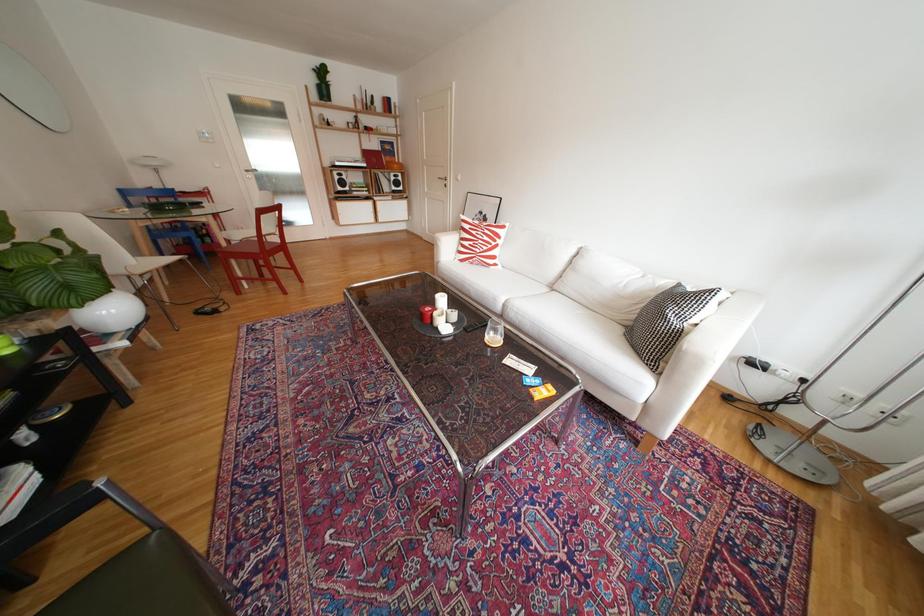
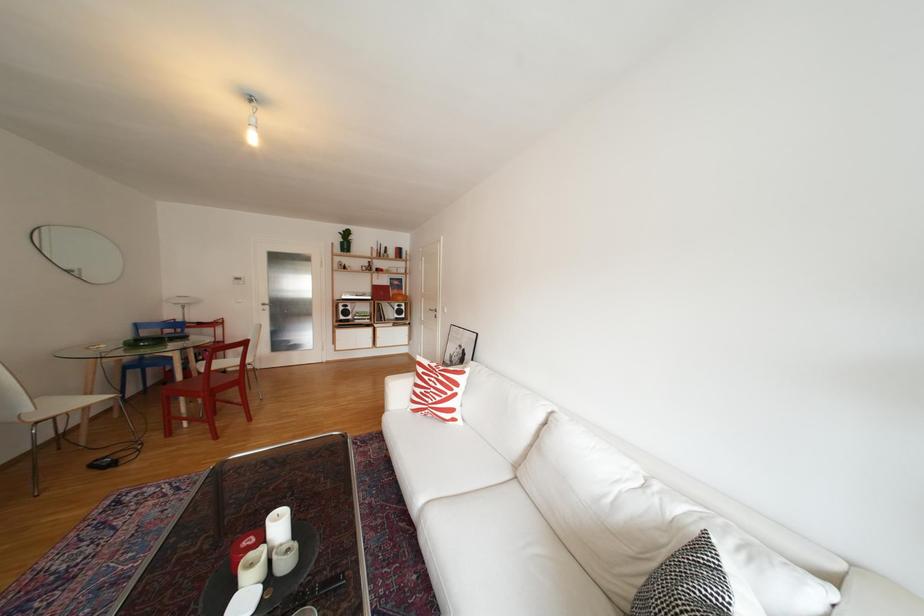
The images are taken continuously from a first-person perspective. In which direction are you moving?

The cameraman moved toward right, forward.